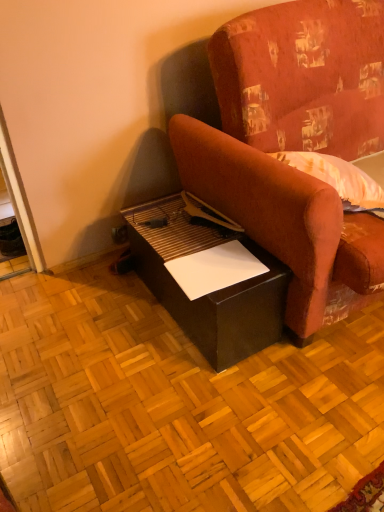
Question: Looking at their shapes, would you say matte black table at lower center is wider or thinner than velvet-like red couch at center?

Choices:
 (A) thin
 (B) wide

Answer: (A)

Question: Based on their positions, is matte black table at lower center located to the left or right of velvet-like red couch at center?

Choices:
 (A) left
 (B) right

Answer: (A)

Question: In terms of size, does matte black table at lower center appear bigger or smaller than velvet-like red couch at center?

Choices:
 (A) big
 (B) small

Answer: (B)

Question: Is velvet-like red couch at center spatially inside matte black table at lower center, or outside of it?

Choices:
 (A) inside
 (B) outside

Answer: (B)

Question: From the image's perspective, is velvet-like red couch at center located above or below matte black table at lower center?

Choices:
 (A) below
 (B) above

Answer: (B)

Question: Based on their sizes in the image, would you say velvet-like red couch at center is bigger or smaller than matte black table at lower center?

Choices:
 (A) small
 (B) big

Answer: (B)

Question: In the image, is velvet-like red couch at center on the left side or the right side of matte black table at lower center?

Choices:
 (A) left
 (B) right

Answer: (B)